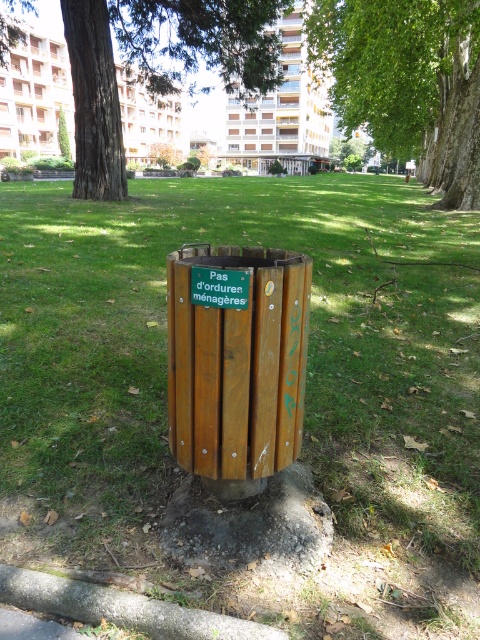
Is green grass at center shorter than green leafy tree at upper center?

Yes.

Who is more distant from viewer, (436, 634) or (436, 81)?

Point (436, 81)

Does point (0, 365) lie behind point (388, 120)?

No, it is in front of (388, 120).

The height and width of the screenshot is (640, 480). I want to click on green grass at center, so (304, 401).

Between green grass at center and wooden trash can at center, which one is positioned higher?

green grass at center

Consider the image. Is green grass at center above wooden trash can at center?

Correct, green grass at center is located above wooden trash can at center.

Where is `green grass at center`? The height and width of the screenshot is (640, 480). green grass at center is located at coordinates (304, 401).

In order to click on green grass at center in this screenshot , I will do `click(304, 401)`.

Is green grass at center below green textured tree at center?

Indeed, green grass at center is positioned under green textured tree at center.

The height and width of the screenshot is (640, 480). I want to click on green grass at center, so click(304, 401).

You are a GUI agent. You are given a task and a screenshot of the screen. Output one action in this format:
    pyautogui.click(x=<x>, y=<y>)
    Task: Click on the green grass at center
    The image size is (480, 640).
    Given the screenshot: What is the action you would take?
    pyautogui.click(x=304, y=401)